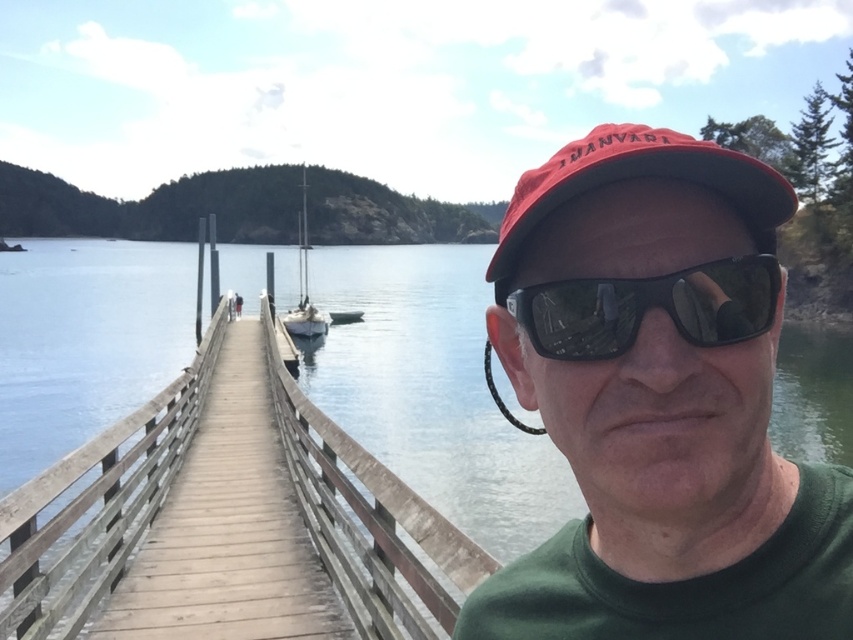
You are a photographer standing on the wooden pier. You want to take a photo that includes both the brown wooden rail at center and the white matte sailboat at center. Which object will appear closer to the bottom of the photo?

The brown wooden rail at center will appear closer to the bottom of the photo because it is shorter than the white matte sailboat at center, making it positioned lower in the frame.

You are a photographer trying to capture the white matte sailboat at center without the brown wooden rail at center blocking the view. Based on the scene, is it possible to position yourself so that the sailboat is fully visible without the rail obstructing it?

The brown wooden rail at center is in front of the white matte sailboat at center, so if you move to a position where the rail is not between you and the sailboat, you can capture the sailboat without obstruction. For example, moving to the side of the pier or further back might allow the sailboat to be fully visible without the rail blocking the view.

You are a photographer standing on the wooden pier. You want to take a photo of the white matte sailboat at center without the red matte baseball cap at upper center appearing in the frame. Is this possible based on their positions?

The red matte baseball cap at upper center is in front of the white matte sailboat at center, so it will block the view. To avoid the cap in the photo, you need to adjust your position or angle to ensure the sailboat is not obscured by the cap.